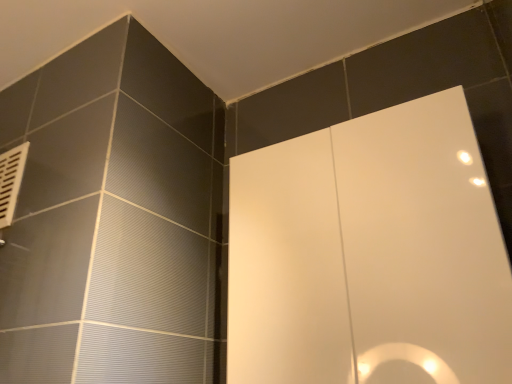
Locate an element on the screen. white glossy screen door at center is located at coordinates (369, 254).

Describe the element at coordinates (369, 254) in the screenshot. The height and width of the screenshot is (384, 512). I see `white glossy screen door at center` at that location.

What do you see at coordinates (11, 181) in the screenshot? I see `white plastic vent at upper left` at bounding box center [11, 181].

Measure the distance between point (13, 174) and camera.

A distance of 1.04 meters exists between point (13, 174) and camera.

The height and width of the screenshot is (384, 512). In order to click on white plastic vent at upper left in this screenshot , I will do `click(11, 181)`.

Find the location of `white glossy screen door at center`. white glossy screen door at center is located at coordinates (369, 254).

Between white glossy screen door at center and white plastic vent at upper left, which one appears on the right side from the viewer's perspective?

white glossy screen door at center is more to the right.

Looking at this image, between white glossy screen door at center and white plastic vent at upper left, which one is positioned in front?

white glossy screen door at center is more forward.

Which is less distant, (281, 300) or (17, 154)?

Clearly, point (281, 300) is closer to the camera than point (17, 154).

From the image's perspective, is white glossy screen door at center beneath white plastic vent at upper left?

Correct, white glossy screen door at center appears lower than white plastic vent at upper left in the image.

From a real-world perspective, is white glossy screen door at center positioned under white plastic vent at upper left based on gravity?

Yes, from a real-world perspective, white glossy screen door at center is under white plastic vent at upper left.

Can you confirm if white glossy screen door at center is thinner than white plastic vent at upper left?

No, white glossy screen door at center is not thinner than white plastic vent at upper left.

Considering the relative sizes of white glossy screen door at center and white plastic vent at upper left in the image provided, is white glossy screen door at center taller than white plastic vent at upper left?

Yes, white glossy screen door at center is taller than white plastic vent at upper left.

Who is smaller, white glossy screen door at center or white plastic vent at upper left?

Smaller between the two is white plastic vent at upper left.

Is white glossy screen door at center outside of white plastic vent at upper left?

Yes, white glossy screen door at center is located beyond the bounds of white plastic vent at upper left.

Is white glossy screen door at center next to white plastic vent at upper left and touching it?

No, white glossy screen door at center is not in contact with white plastic vent at upper left.

From the picture: Is white glossy screen door at center oriented towards white plastic vent at upper left?

No, white glossy screen door at center does not turn towards white plastic vent at upper left.

This screenshot has height=384, width=512. In order to click on air conditioner behind the white glossy screen door at center in this screenshot , I will do `click(11, 181)`.

In the scene shown: Considering the relative positions of white plastic vent at upper left and white glossy screen door at center in the image provided, is white plastic vent at upper left to the right of white glossy screen door at center from the viewer's perspective?

Incorrect, white plastic vent at upper left is not on the right side of white glossy screen door at center.

Which object is more forward, white plastic vent at upper left or white glossy screen door at center?

white glossy screen door at center.

Is point (1, 162) closer to viewer compared to point (386, 300)?

That is False.

From the image's perspective, is white plastic vent at upper left located above white glossy screen door at center?

Correct, white plastic vent at upper left appears higher than white glossy screen door at center in the image.

From a real-world perspective, who is located higher, white plastic vent at upper left or white glossy screen door at center?

Result: white plastic vent at upper left.

Considering the relative sizes of white plastic vent at upper left and white glossy screen door at center in the image provided, is white plastic vent at upper left wider than white glossy screen door at center?

No, white plastic vent at upper left is not wider than white glossy screen door at center.

Can you confirm if white plastic vent at upper left is taller than white glossy screen door at center?

No.

Is white plastic vent at upper left smaller than white glossy screen door at center?

Yes.

Would you say white plastic vent at upper left is outside white glossy screen door at center?

Yes.

Is white plastic vent at upper left far from white glossy screen door at center?

Actually, white plastic vent at upper left and white glossy screen door at center are a little close together.

Is white glossy screen door at center at the back of white plastic vent at upper left?

white plastic vent at upper left does not have its back to white glossy screen door at center.

What's the angular difference between white plastic vent at upper left and white glossy screen door at center's facing directions?

They differ by 0.0437 degrees in their facing directions.

At what (x,y) coordinates should I click in order to perform the action: click on screen door on the right side of white plastic vent at upper left. Please return your answer as a coordinate pair (x, y). Looking at the image, I should click on (369, 254).

This screenshot has width=512, height=384. In order to click on air conditioner positioned vertically above the white glossy screen door at center (from a real-world perspective) in this screenshot , I will do `click(11, 181)`.

Where is `screen door to the right of white plastic vent at upper left`? Image resolution: width=512 pixels, height=384 pixels. screen door to the right of white plastic vent at upper left is located at coordinates (369, 254).